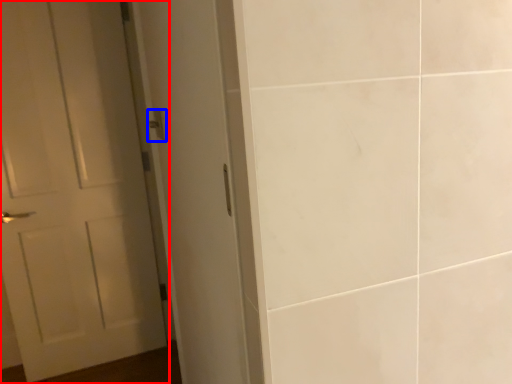
Question: Which point is further to the camera, door (highlighted by a red box) or door handle (highlighted by a blue box)?

Choices:
 (A) door
 (B) door handle

Answer: (A)